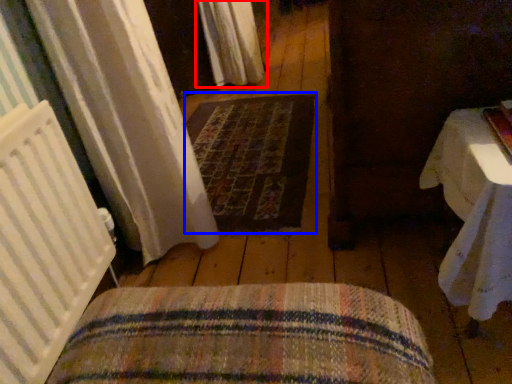
Question: Which of the following is the farthest to the observer, curtain (highlighted by a red box) or mat (highlighted by a blue box)?

Choices:
 (A) curtain
 (B) mat

Answer: (A)